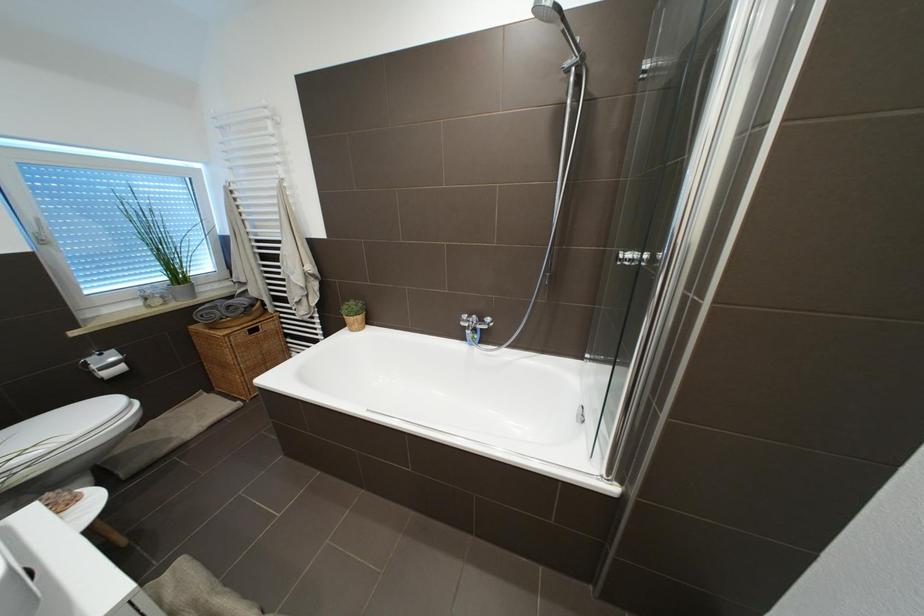
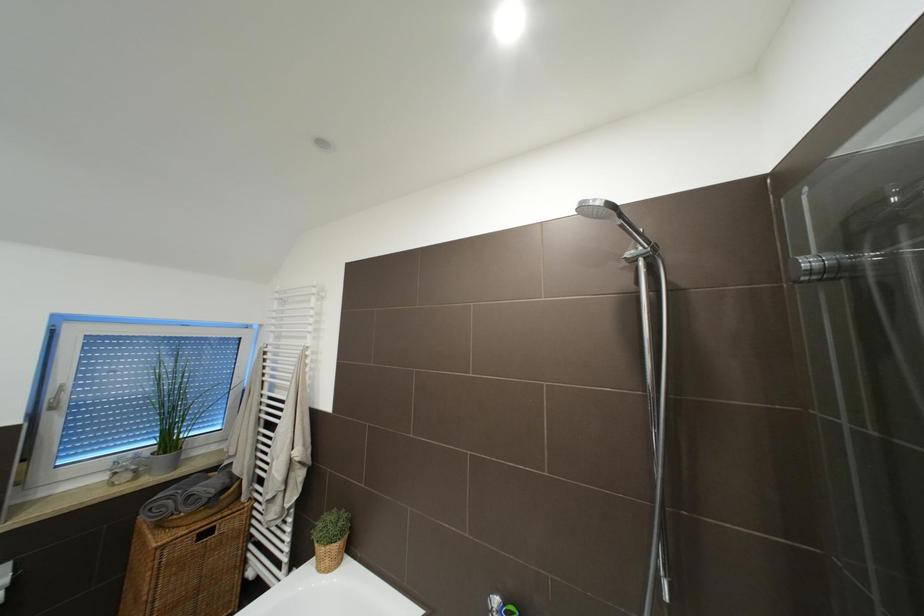
Question: Based on the continuous images, in which direction is the camera rotating? Reply with the corresponding letter.

Choices:
 (A) Left
 (B) Right
 (C) Up
 (D) Down

Answer: (C)